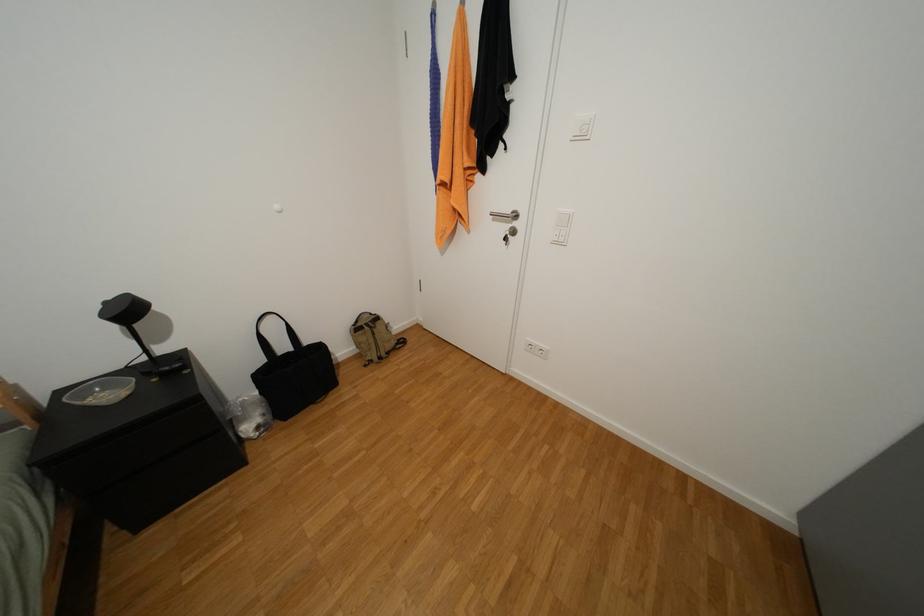
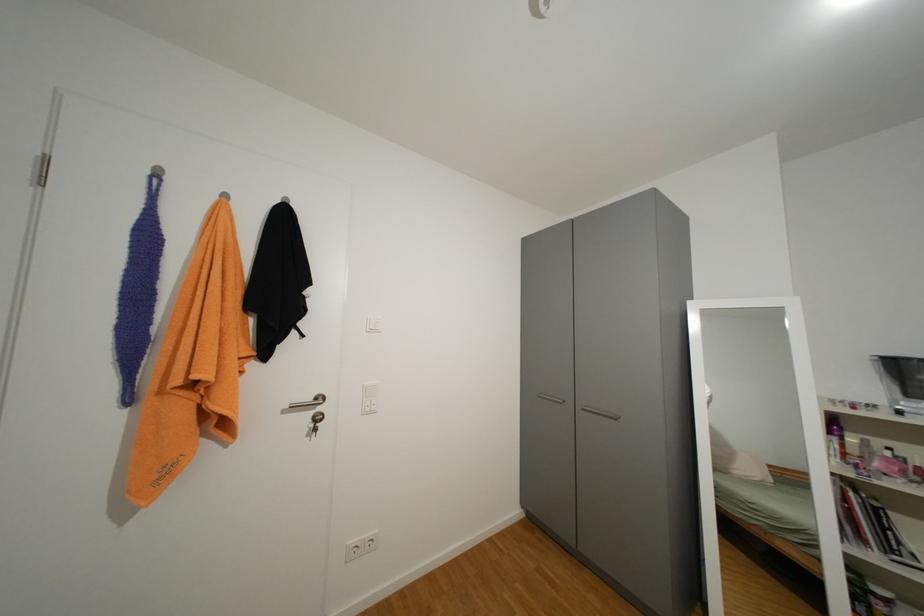
Question: Based on the continuous images, in which direction is the camera rotating? Reply with the corresponding letter.

Choices:
 (A) Left
 (B) Right
 (C) Up
 (D) Down

Answer: (B)